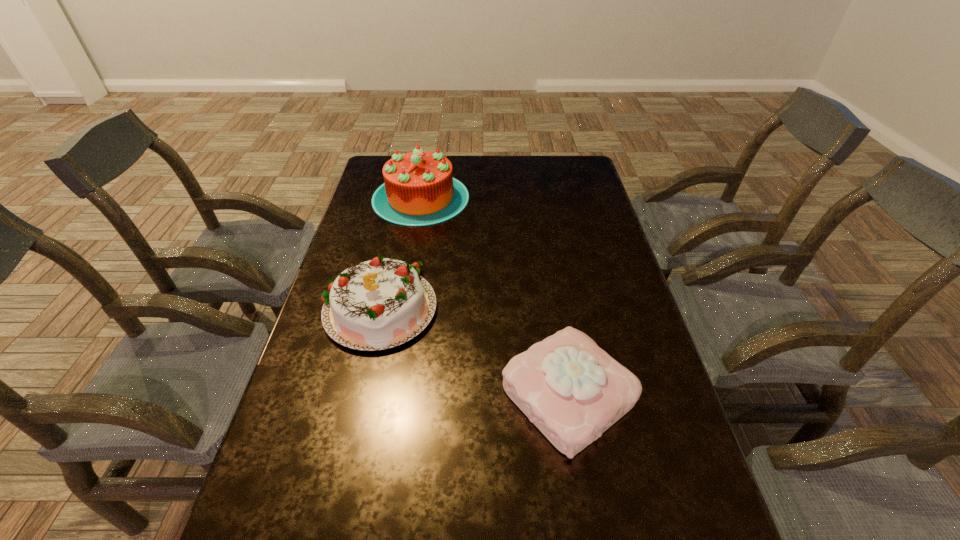
You are a GUI agent. You are given a task and a screenshot of the screen. Output one action in this format:
    pyautogui.click(x=<x>, y=<y>)
    Task: Click on the vacant space at the right edge of the desktop
    
    Given the screenshot: What is the action you would take?
    pyautogui.click(x=641, y=348)

Locate an element on the screen. The width and height of the screenshot is (960, 540). free area in between the shortest object and the farthest object is located at coordinates (494, 296).

Where is `empty space between the farthest cake and the rightmost object`? empty space between the farthest cake and the rightmost object is located at coordinates (494, 296).

The height and width of the screenshot is (540, 960). I want to click on free space between the farthest object and the rightmost object, so click(494, 296).

At what (x,y) coordinates should I click in order to perform the action: click on free space between the farthest cake and the shortest cake. Please return your answer as a coordinate pair (x, y). This screenshot has width=960, height=540. Looking at the image, I should click on (494, 296).

You are a GUI agent. You are given a task and a screenshot of the screen. Output one action in this format:
    pyautogui.click(x=<x>, y=<y>)
    Task: Click on the free space between the farthest object and the shortest cake
    The image size is (960, 540).
    Given the screenshot: What is the action you would take?
    pyautogui.click(x=494, y=296)

Identify which object is located as the nearest to the rightmost cake. Please provide its 2D coordinates. Your answer should be formatted as a tuple, i.e. [(x, y)], where the tuple contains the x and y coordinates of a point satisfying the conditions above.

[(378, 304)]

Identify which object is located as the second nearest to the rightmost cake. Please provide its 2D coordinates. Your answer should be formatted as a tuple, i.e. [(x, y)], where the tuple contains the x and y coordinates of a point satisfying the conditions above.

[(419, 189)]

Identify which cake is the second closest to the farthest cake. Please provide its 2D coordinates. Your answer should be formatted as a tuple, i.e. [(x, y)], where the tuple contains the x and y coordinates of a point satisfying the conditions above.

[(572, 390)]

The height and width of the screenshot is (540, 960). I want to click on cake that stands as the second closest to the rightmost cake, so click(419, 189).